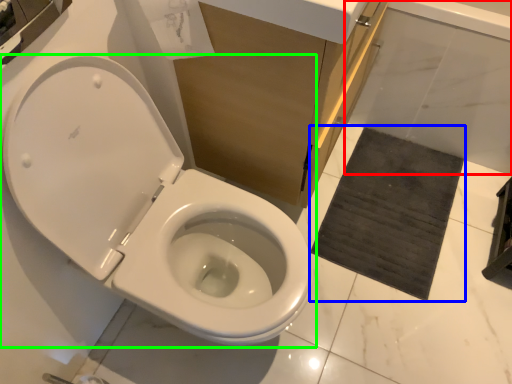
Question: Which object is positioned farthest from bath (highlighted by a red box)? Select from bath mat (highlighted by a blue box) and toilet (highlighted by a green box).

Choices:
 (A) bath mat
 (B) toilet

Answer: (B)